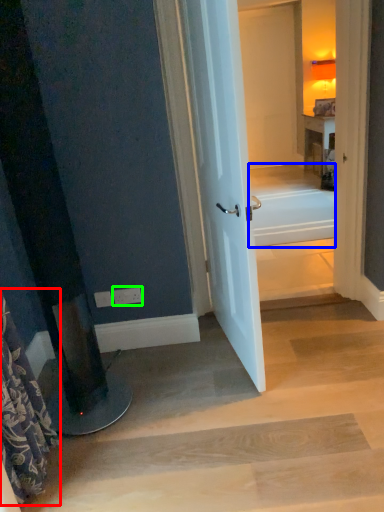
Question: Which is farther away from shower curtain (highlighted by a red box)? bath (highlighted by a blue box) or electric outlet (highlighted by a green box)?

Choices:
 (A) bath
 (B) electric outlet

Answer: (A)